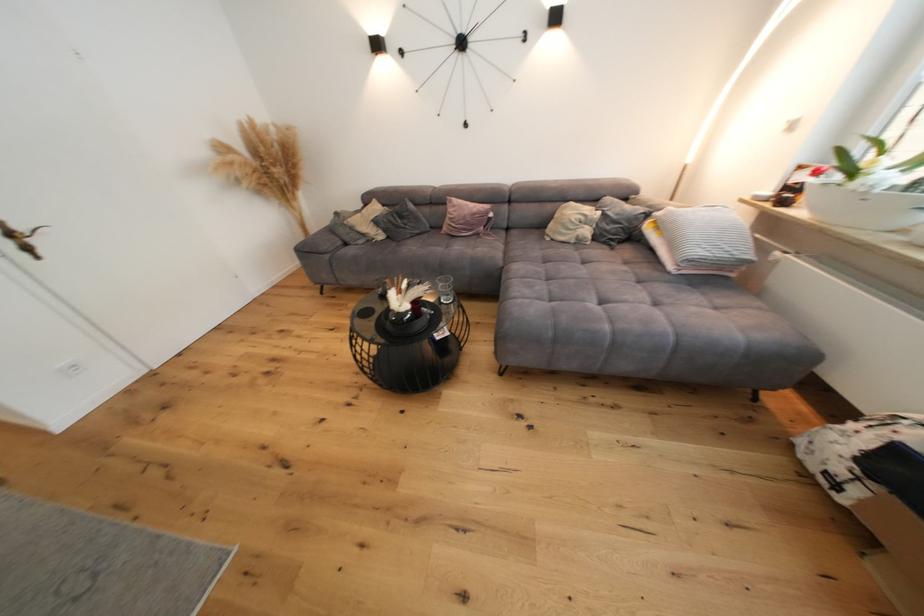
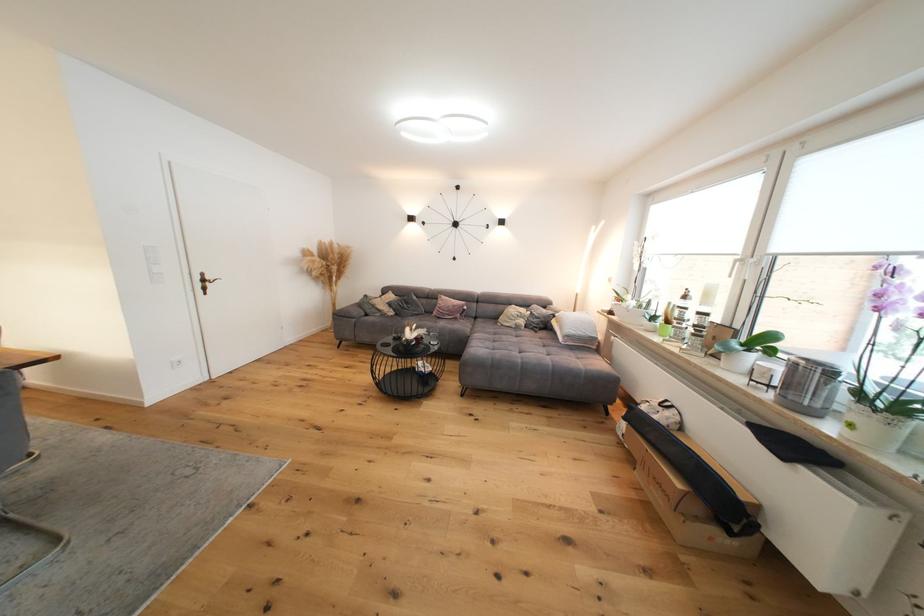
The point at (593, 233) is marked in the first image. Where is the corresponding point in the second image?

(529, 323)